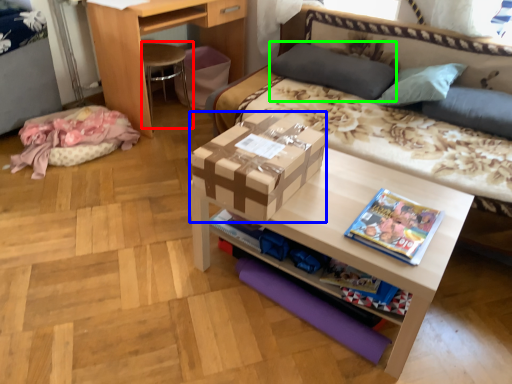
Question: Which object is positioned closest to chair (highlighted by a red box)? Select from box (highlighted by a blue box) and pillow (highlighted by a green box).

Choices:
 (A) box
 (B) pillow

Answer: (B)